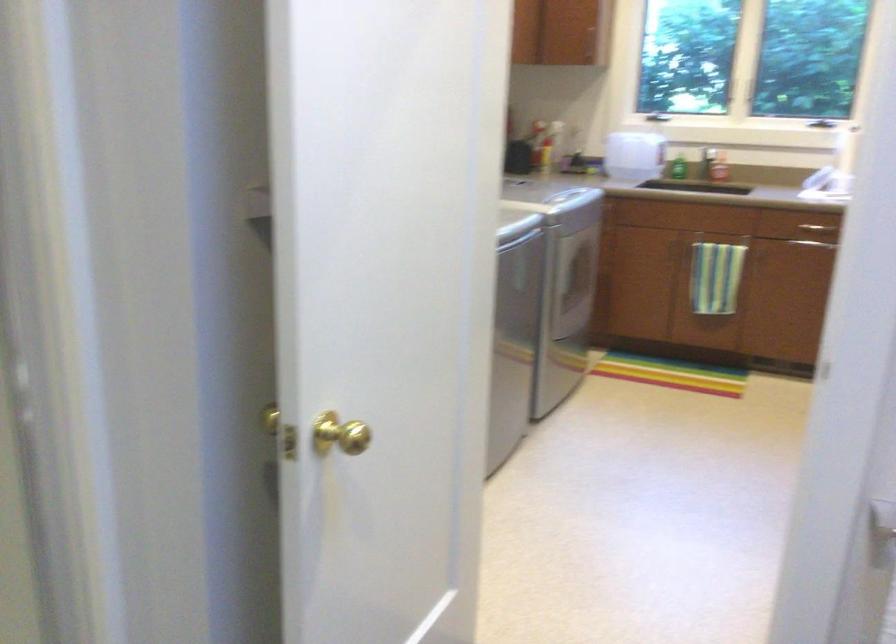
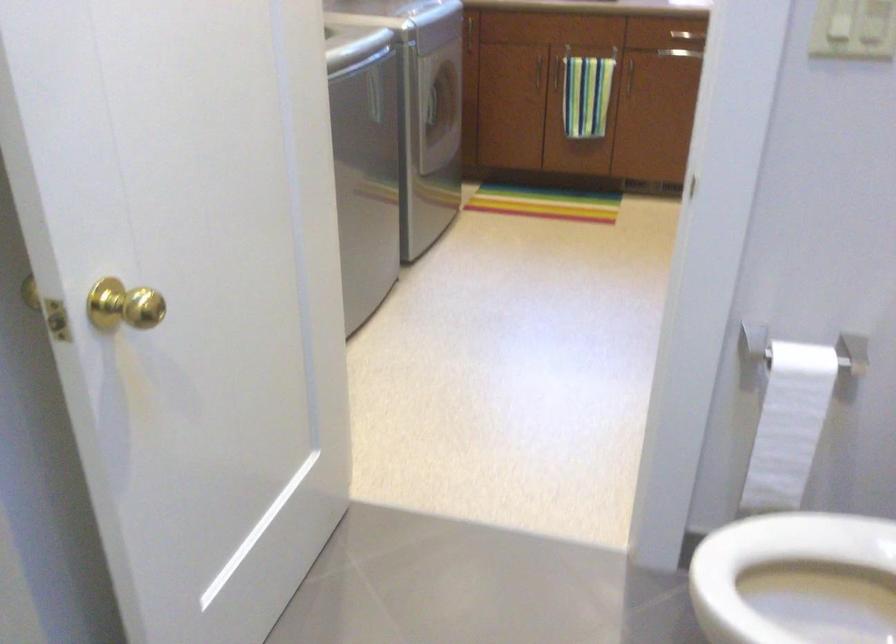
Question: Based on the continuous images, in which direction is the camera rotating? Reply with the corresponding letter.

Choices:
 (A) Left
 (B) Right
 (C) Up
 (D) Down

Answer: (D)